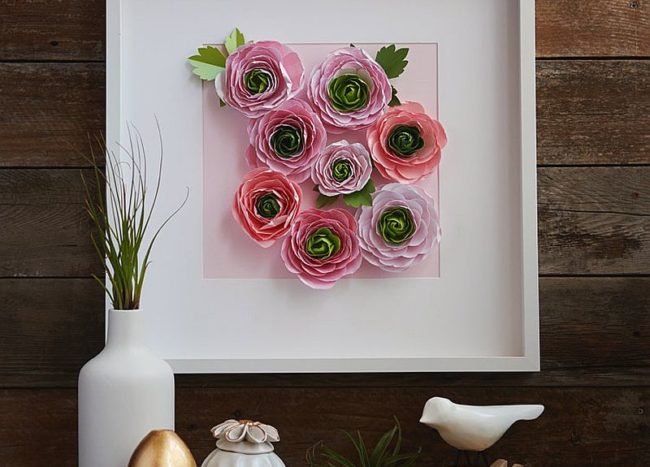
Find the location of `wood panels`. wood panels is located at coordinates (619, 38), (598, 126), (608, 216), (598, 324), (590, 410).